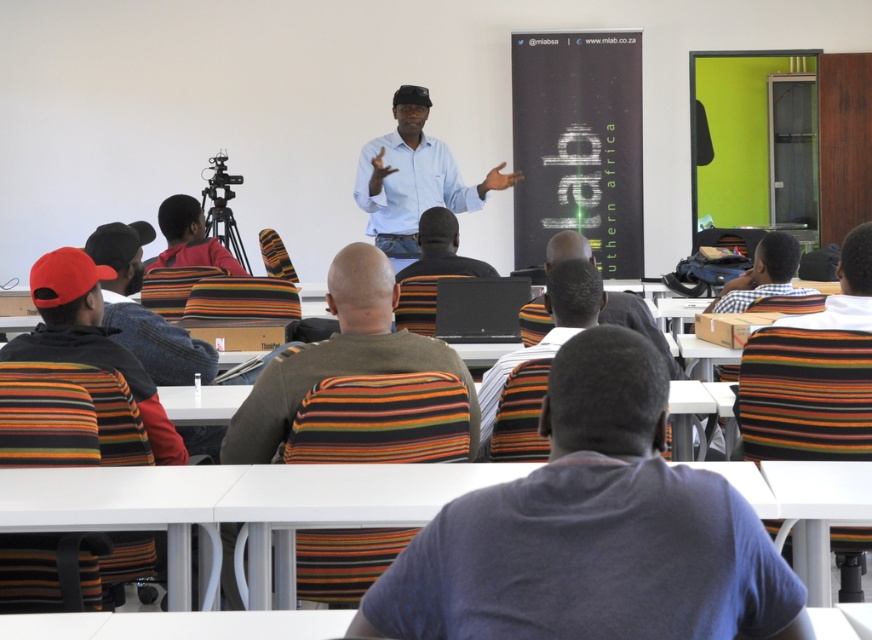
Is striped sweater at center to the right of striped shirt at center from the viewer's perspective?

Incorrect, striped sweater at center is not on the right side of striped shirt at center.

Between point (335, 371) and point (454, 275), which one is positioned in front?

Positioned in front is point (335, 371).

Image resolution: width=872 pixels, height=640 pixels. What are the coordinates of `striped sweater at center` in the screenshot? It's located at (345, 376).

Describe the element at coordinates (593, 531) in the screenshot. I see `dark gray hoodie at center` at that location.

Does dark gray hoodie at center have a greater width compared to matte black screen at upper center?

No, dark gray hoodie at center is not wider than matte black screen at upper center.

Between point (754, 531) and point (608, 65), which one is positioned in front?

Point (754, 531) is more forward.

Locate an element on the screen. dark gray hoodie at center is located at coordinates (593, 531).

Does matte black screen at upper center have a smaller size compared to striped shirt at center?

Actually, matte black screen at upper center might be larger than striped shirt at center.

Is matte black screen at upper center to the right of striped shirt at center from the viewer's perspective?

Yes, matte black screen at upper center is to the right of striped shirt at center.

Locate an element on the screen. matte black screen at upper center is located at coordinates (578, 145).

The image size is (872, 640). In order to click on matte black screen at upper center in this screenshot , I will do `click(578, 145)`.